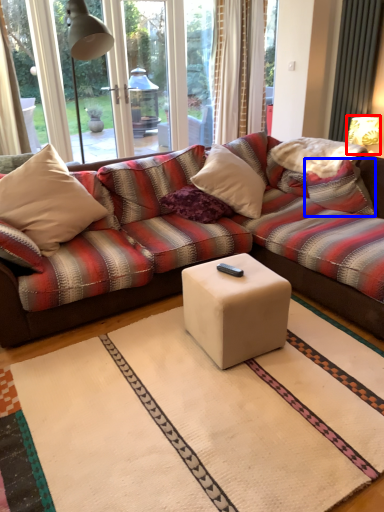
Question: Among these objects, which one is farthest to the camera, table lamp (highlighted by a red box) or pillow (highlighted by a blue box)?

Choices:
 (A) table lamp
 (B) pillow

Answer: (A)